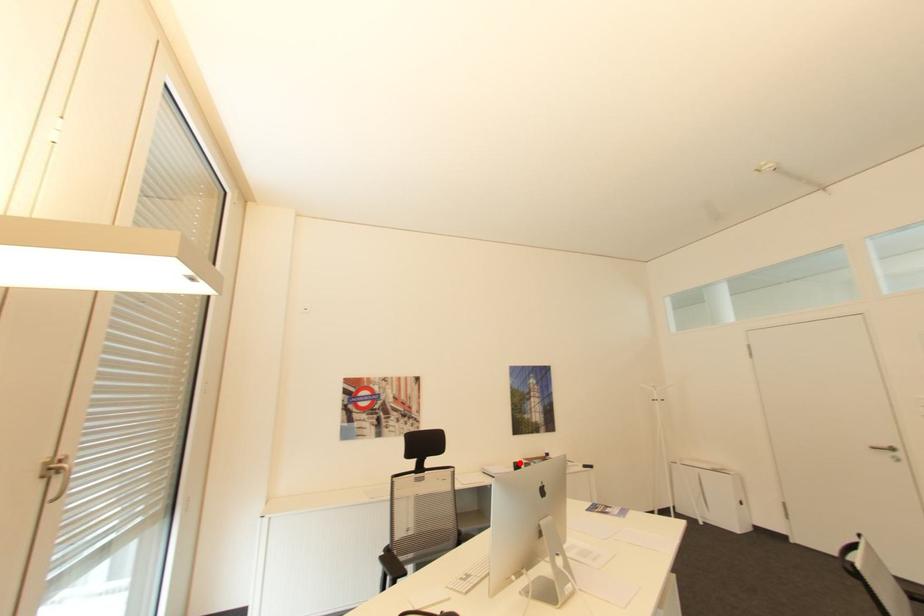
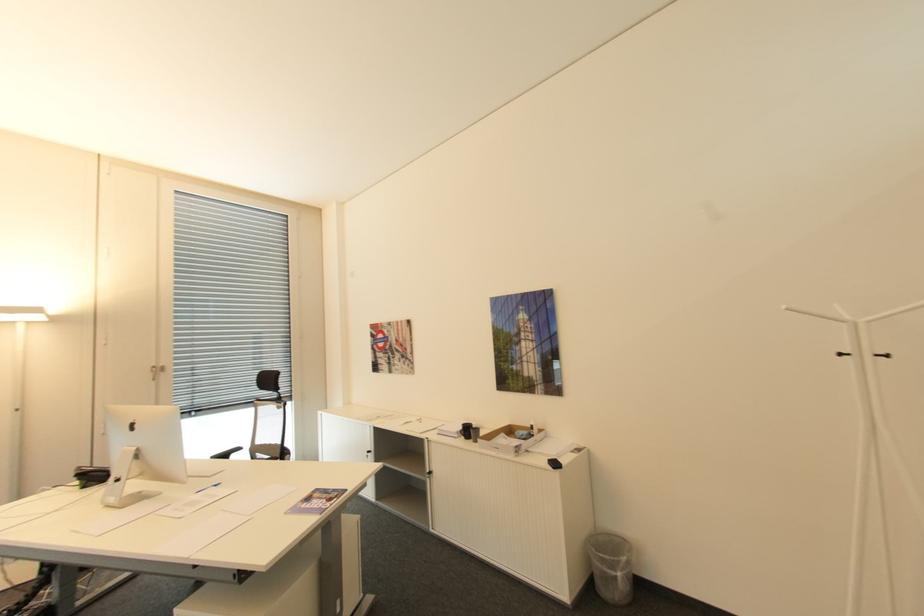
In the second image, find the point that corresponds to the highlighted location in the first image.

(468, 424)